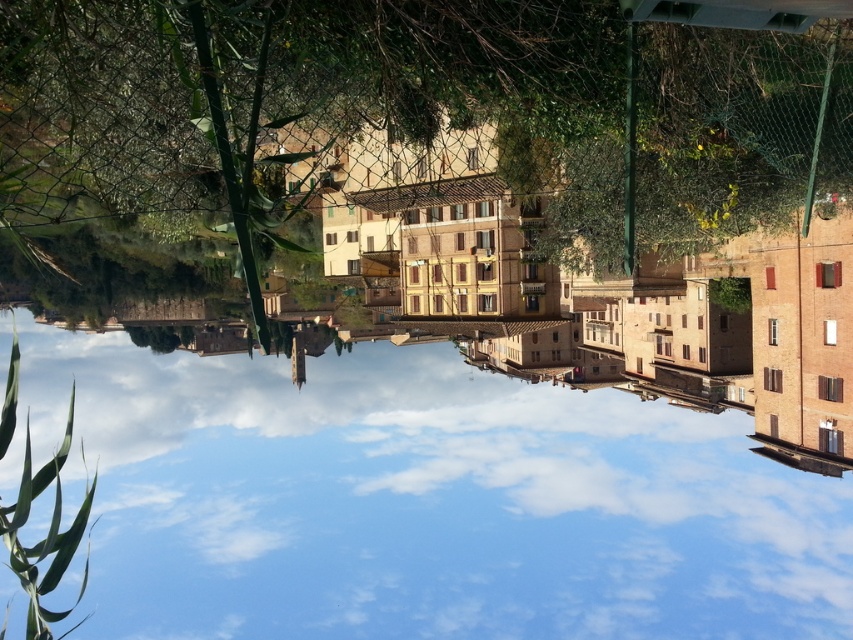
Between transparent glass water at center and green leafy tree at upper center, which one has more height?

transparent glass water at center is taller.

What do you see at coordinates (419, 500) in the screenshot? The image size is (853, 640). I see `transparent glass water at center` at bounding box center [419, 500].

The width and height of the screenshot is (853, 640). I want to click on transparent glass water at center, so click(x=419, y=500).